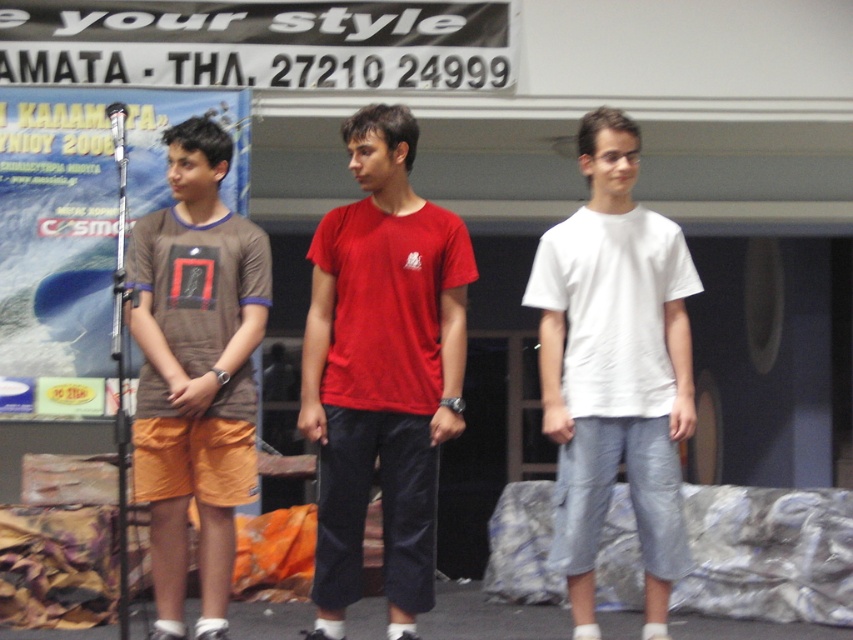
Who is higher up, matte red t-shirt at center or white matte t-shirt at center?

white matte t-shirt at center is higher up.

Is point (386, 246) closer to camera compared to point (633, 397)?

That is False.

You are a GUI agent. You are given a task and a screenshot of the screen. Output one action in this format:
    pyautogui.click(x=<x>, y=<y>)
    Task: Click on the matte red t-shirt at center
    The width and height of the screenshot is (853, 640).
    Given the screenshot: What is the action you would take?
    pyautogui.click(x=381, y=371)

Measure the distance from matte red t-shirt at center to white cotton t-shirt at center.

matte red t-shirt at center and white cotton t-shirt at center are 75.98 centimeters apart from each other.

Is matte red t-shirt at center below white cotton t-shirt at center?

No, matte red t-shirt at center is not below white cotton t-shirt at center.

This screenshot has height=640, width=853. What are the coordinates of `matte red t-shirt at center` in the screenshot? It's located at (381, 371).

Find the location of a particular element. The height and width of the screenshot is (640, 853). matte red t-shirt at center is located at coordinates (381, 371).

Which is more to the left, matte brown t-shirt at center or white matte t-shirt at center?

matte brown t-shirt at center is more to the left.

Is point (186, 141) farther from viewer compared to point (650, 365)?

Yes, point (186, 141) is farther from viewer.

Find the location of a particular element. matte brown t-shirt at center is located at coordinates (195, 371).